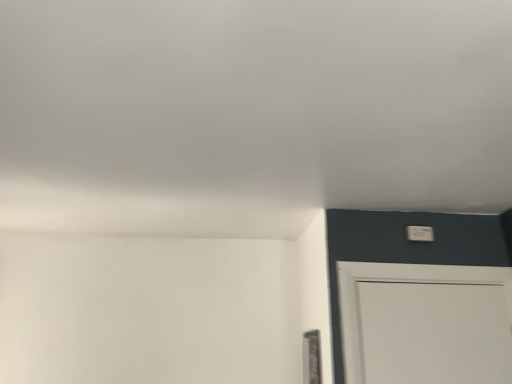
Question: Is clear glass window at lower right aimed at white plastic light switch at upper right?

Choices:
 (A) yes
 (B) no

Answer: (B)

Question: Is clear glass window at lower right far from white plastic light switch at upper right?

Choices:
 (A) no
 (B) yes

Answer: (A)

Question: Considering the relative sizes of clear glass window at lower right and white plastic light switch at upper right in the image provided, is clear glass window at lower right thinner than white plastic light switch at upper right?

Choices:
 (A) yes
 (B) no

Answer: (A)

Question: Is clear glass window at lower right bigger than white plastic light switch at upper right?

Choices:
 (A) yes
 (B) no

Answer: (A)

Question: Is clear glass window at lower right behind white plastic light switch at upper right?

Choices:
 (A) yes
 (B) no

Answer: (B)

Question: Is clear glass window at lower right wider than white plastic light switch at upper right?

Choices:
 (A) yes
 (B) no

Answer: (B)

Question: Is white plastic light switch at upper right to the left of clear glass window at lower right from the viewer's perspective?

Choices:
 (A) yes
 (B) no

Answer: (B)

Question: Does white plastic light switch at upper right have a larger size compared to clear glass window at lower right?

Choices:
 (A) yes
 (B) no

Answer: (B)

Question: From the image's perspective, is white plastic light switch at upper right on clear glass window at lower right?

Choices:
 (A) yes
 (B) no

Answer: (A)

Question: Is white plastic light switch at upper right positioned before clear glass window at lower right?

Choices:
 (A) yes
 (B) no

Answer: (B)

Question: From a real-world perspective, is white plastic light switch at upper right under clear glass window at lower right?

Choices:
 (A) no
 (B) yes

Answer: (A)

Question: From a real-world perspective, is white plastic light switch at upper right over clear glass window at lower right?

Choices:
 (A) yes
 (B) no

Answer: (A)

Question: From their relative heights in the image, would you say white plastic light switch at upper right is taller or shorter than clear glass window at lower right?

Choices:
 (A) tall
 (B) short

Answer: (B)